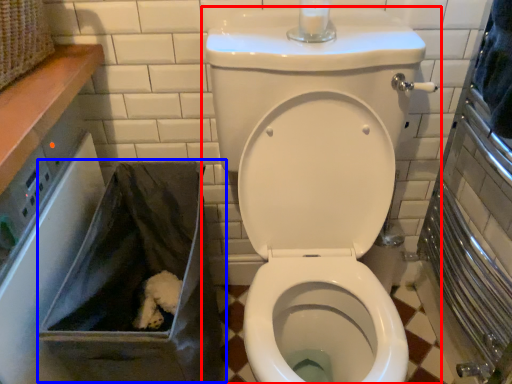
Question: Which point is closer to the camera, toilet (highlighted by a red box) or recycling bin (highlighted by a blue box)?

Choices:
 (A) toilet
 (B) recycling bin

Answer: (A)